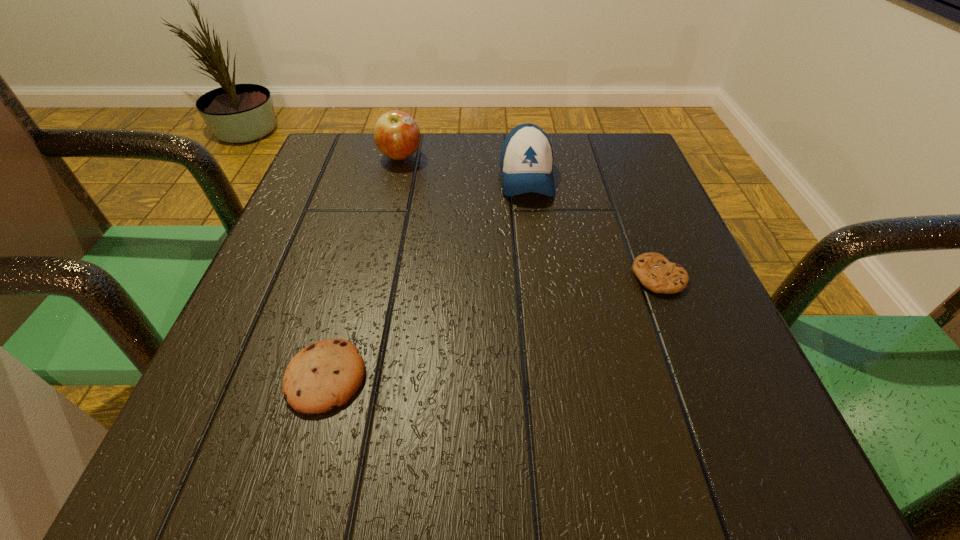
This screenshot has height=540, width=960. Find the location of `blank space at the far right corner of the desktop`. blank space at the far right corner of the desktop is located at coordinates (602, 182).

Locate an element on the screen. This screenshot has width=960, height=540. free space at the near right corner is located at coordinates click(x=773, y=471).

The height and width of the screenshot is (540, 960). Identify the location of free space that is in between the apple and the shortest object. (530, 217).

I want to click on free area in between the apple and the baseball cap, so click(x=464, y=167).

This screenshot has height=540, width=960. What are the coordinates of `vacant space that's between the third tallest object and the apple` in the screenshot? It's located at (363, 267).

What are the coordinates of `free space between the shorter cookie and the apple` in the screenshot? It's located at (530, 217).

Locate an element on the screen. unoccupied area between the baseball cap and the apple is located at coordinates (464, 167).

Locate an element on the screen. This screenshot has width=960, height=540. free space between the apple and the third object from left to right is located at coordinates (464, 167).

Find the location of `free space between the shorter cookie and the taller cookie`. free space between the shorter cookie and the taller cookie is located at coordinates (492, 327).

At what (x,y) coordinates should I click in order to perform the action: click on vacant space that is in between the left cookie and the baseball cap. Please return your answer as a coordinate pair (x, y). Looking at the image, I should click on (426, 278).